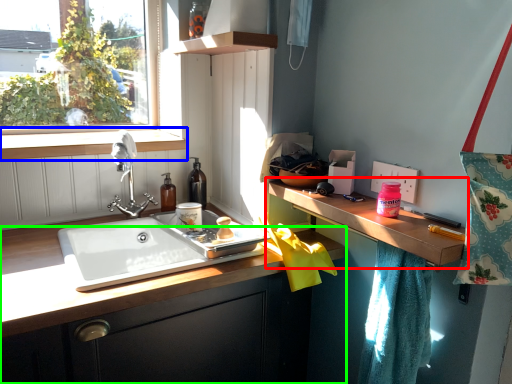
Question: Based on their relative distances, which object is farther from countertop (highlighted by a red box)? Choose from window sill (highlighted by a blue box) and cabinetry (highlighted by a green box).

Choices:
 (A) window sill
 (B) cabinetry

Answer: (A)